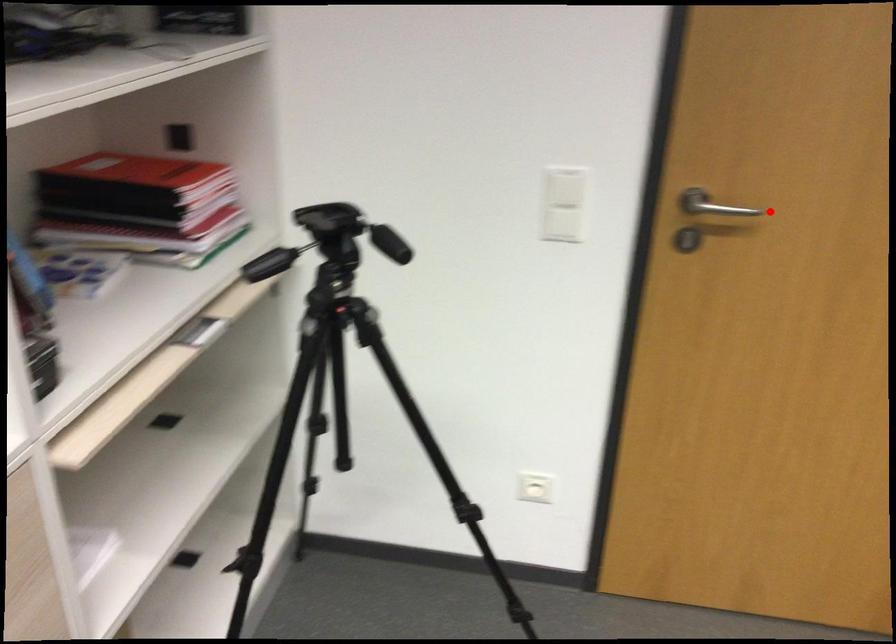
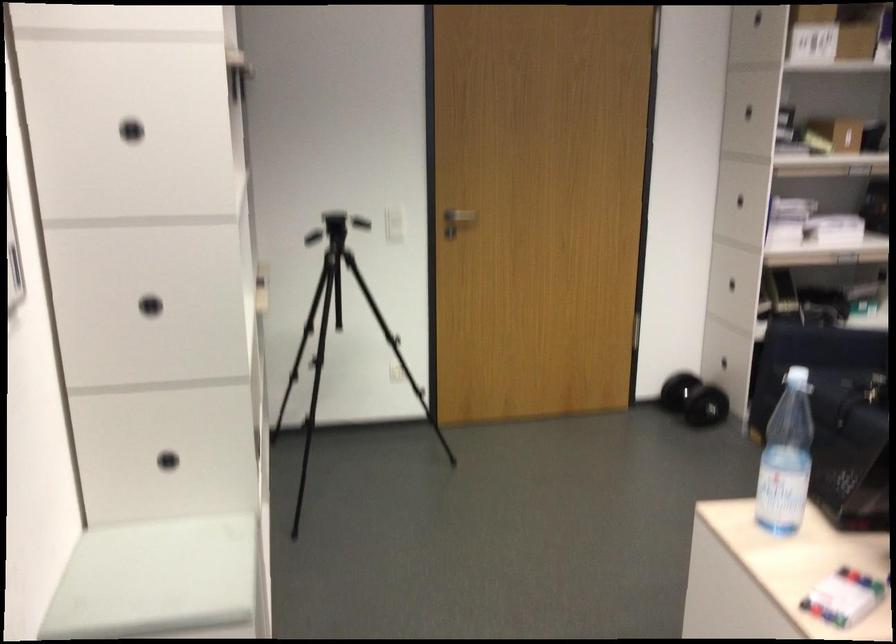
Question: A red point is marked in image1. In image2, is the corresponding 3D point closer to the camera or farther? Reply with the corresponding letter.

Choices:
 (A) The corresponding 3D point is closer.
 (B) The corresponding 3D point is farther.

Answer: (B)